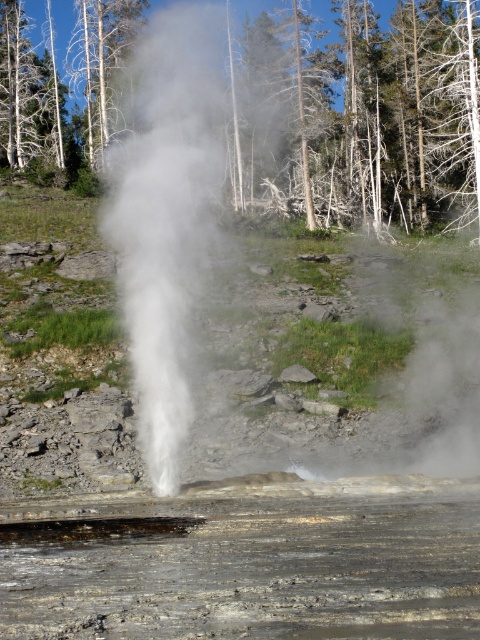
You are standing at the center of the image and want to walk towards the dead wood tree at center. Which direction should you move?

The dead wood tree at center is already at the center of the image, so you are already facing it. No need to move in any direction.

You are a park ranger assessing the safety of the area around the dead wood tree at center and the white vapor at center. Based on their relative heights, which object is more likely to be a potential hazard for visitors? Explain your reasoning.

The white vapor at center is taller than the dead wood tree at center. Since the vapor plume is rising higher, it indicates stronger geothermal activity, which could pose a higher risk of sudden eruptions or toxic gases, making it a greater potential hazard than the shorter dead wood tree.